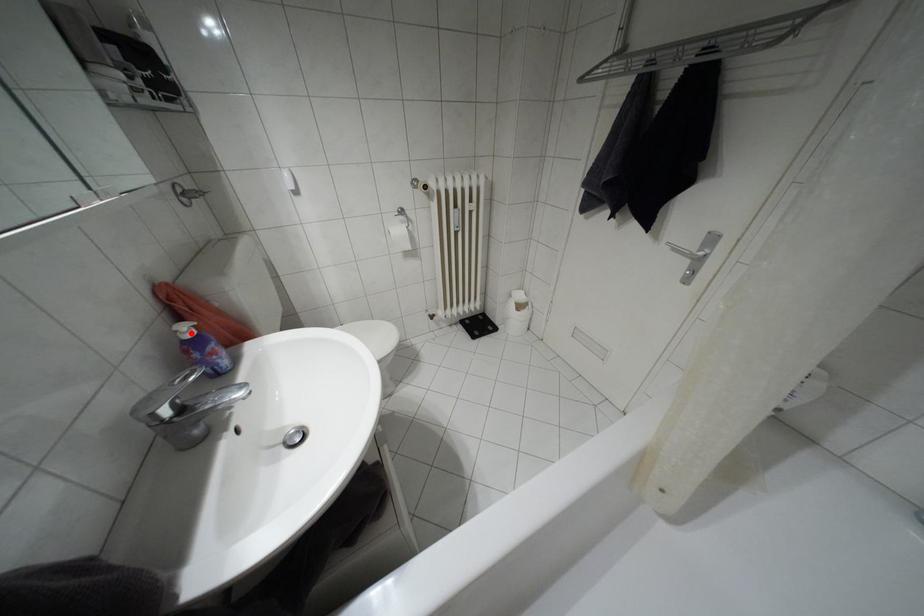
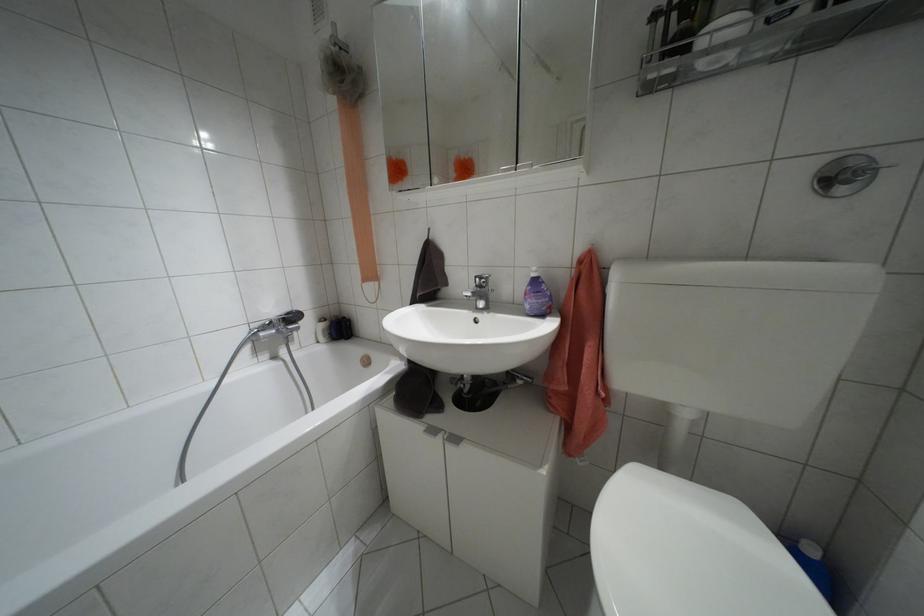
Where in the second image is the point corresponding to the highlighted location from the first image?

(532, 274)